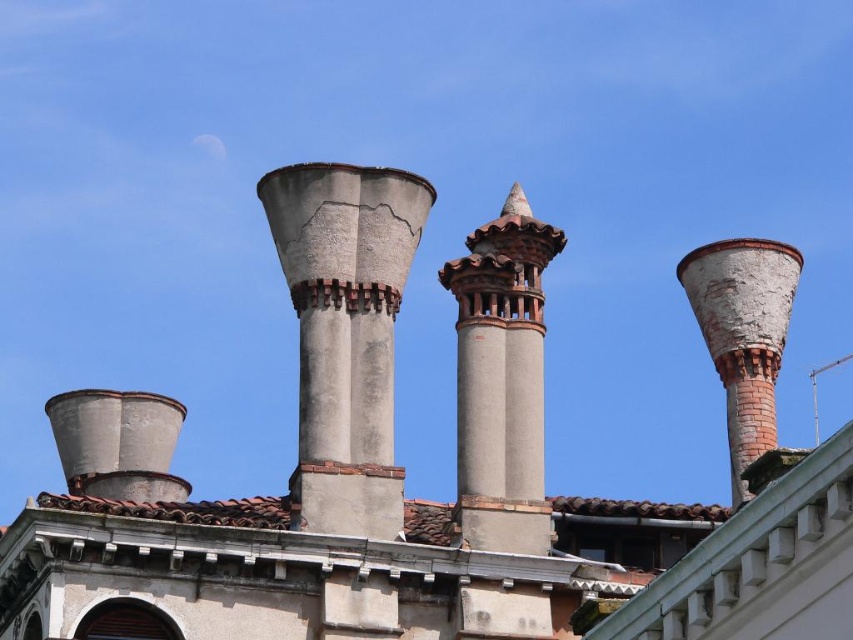
Measure the distance between terracotta textured chimney at center and camera.

terracotta textured chimney at center and camera are 63.58 meters apart from each other.

Does point (534, 461) come in front of point (761, 401)?

Yes, point (534, 461) is in front of point (761, 401).

Who is more distant from viewer, (483, 237) or (743, 445)?

The point (743, 445) is more distant.

Locate an element on the screen. The width and height of the screenshot is (853, 640). terracotta textured chimney at center is located at coordinates point(502,380).

Is gray concrete chimney at center below terracotta textured chimney at center?

Yes.

Between point (338, 252) and point (463, 308), which one is positioned behind?

Point (463, 308)

Who is more distant from viewer, (375, 188) or (500, 442)?

Positioned behind is point (375, 188).

I want to click on gray concrete chimney at center, so click(x=345, y=333).

In the scene shown: Can you confirm if gray concrete chimney at center is positioned to the left of white brick chimney at right?

Indeed, gray concrete chimney at center is positioned on the left side of white brick chimney at right.

Does gray concrete chimney at center have a smaller size compared to white brick chimney at right?

Incorrect, gray concrete chimney at center is not smaller in size than white brick chimney at right.

Does point (318, 337) lie behind point (735, 330)?

No, (318, 337) is in front of (735, 330).

Where is `gray concrete chimney at center`? The width and height of the screenshot is (853, 640). gray concrete chimney at center is located at coordinates (345, 333).